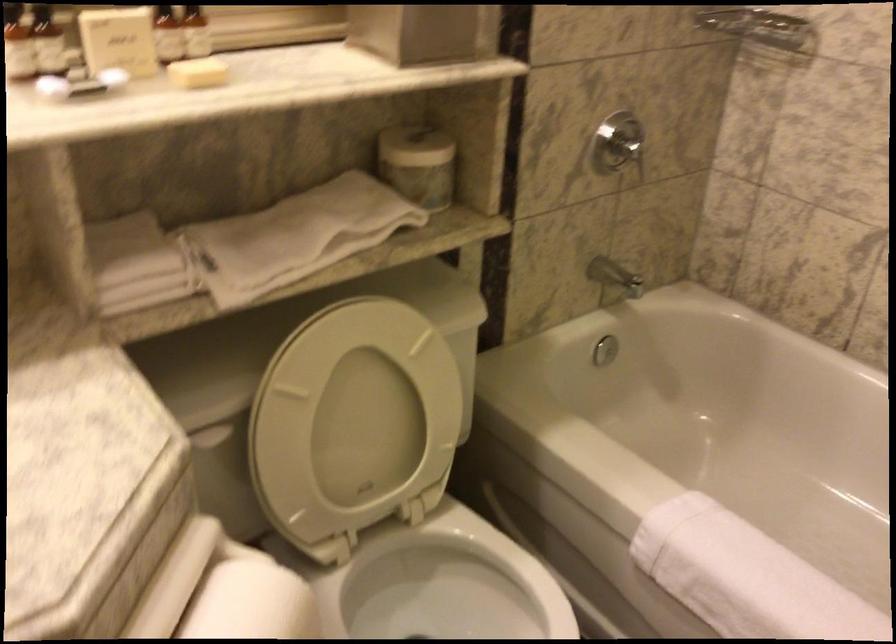
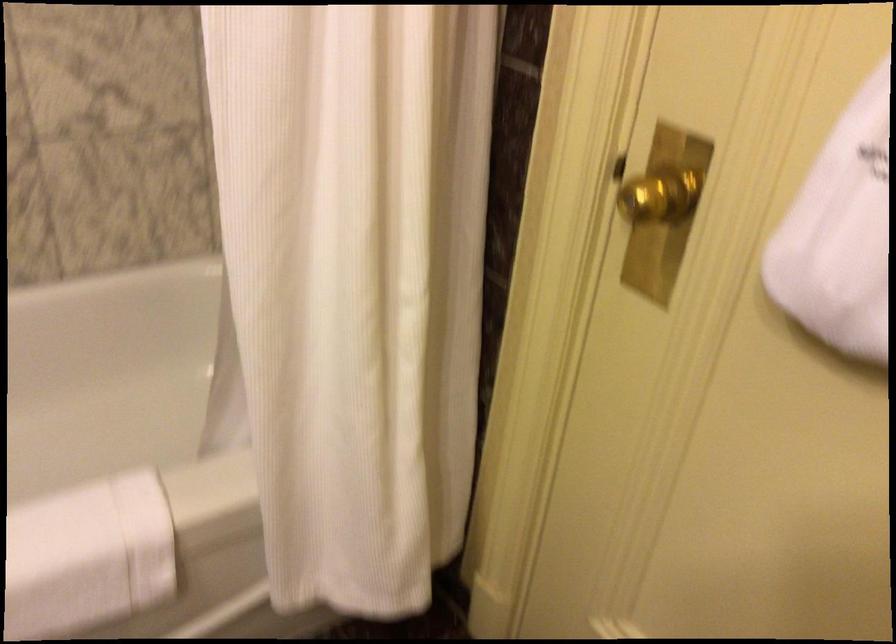
How did the camera likely rotate?

The camera's rotation is toward right-down.